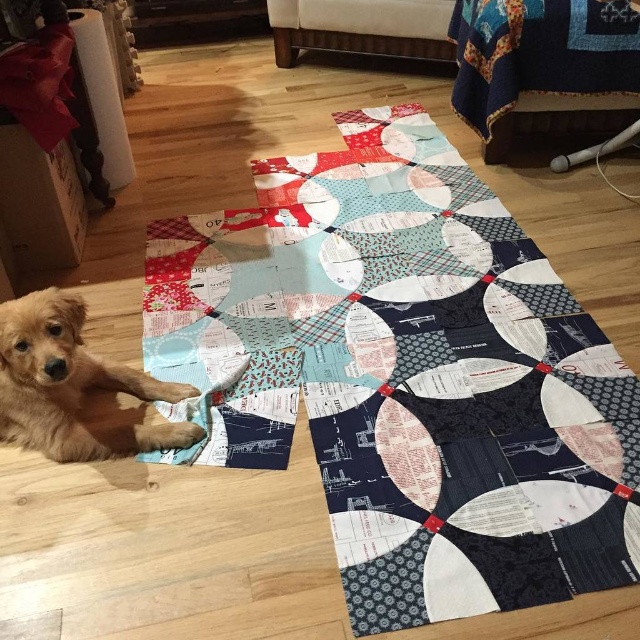
Is point (205, 228) in front of point (36, 291)?

No, it is not.

Between patchwork quilt at center and golden fur dog at lower left, which one appears on the left side from the viewer's perspective?

Positioned to the left is golden fur dog at lower left.

I want to click on patchwork quilt at center, so click(x=406, y=374).